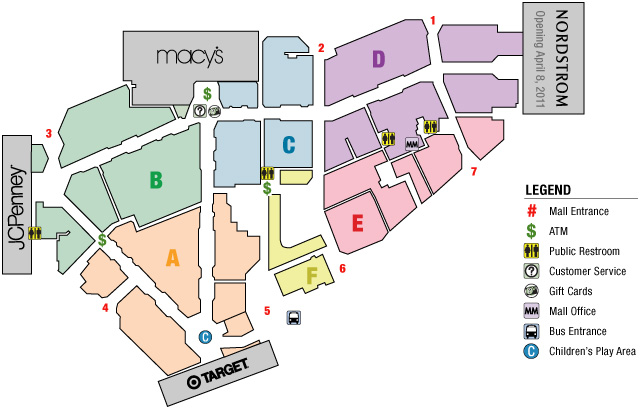
Identify the location of public restroom. This screenshot has width=640, height=410. (33, 234), (267, 170), (388, 137), (434, 125).